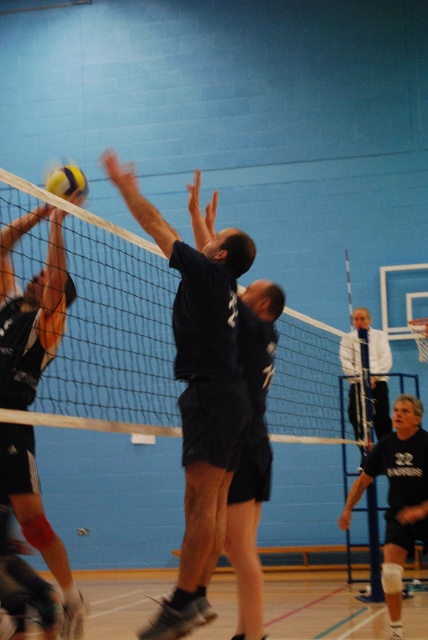
Question: Which of the following is the closest to the observer?

Choices:
 (A) (237, 388)
 (B) (330, 417)
 (C) (17, 324)
 (D) (374, 339)

Answer: (A)

Question: Can you confirm if white fabric shirt at upper center is thinner than yellowmaterial/texturevolleyball at upper left?

Choices:
 (A) no
 (B) yes

Answer: (A)

Question: Can you confirm if black matte shorts at center is positioned to the left of white fabric shirt at upper center?

Choices:
 (A) no
 (B) yes

Answer: (B)

Question: Among these points, which one is farthest from the camera?

Choices:
 (A) (210, 344)
 (B) (61, 230)
 (C) (425, 477)

Answer: (C)

Question: Which of the following is the farthest from the observer?

Choices:
 (A) yellowmaterial/texturevolleyball at upper left
 (B) black matte shorts at center
 (C) matte black shorts at center

Answer: (B)

Question: Does black matte shorts at center have a lesser width compared to yellowmaterial/texturevolleyball at upper left?

Choices:
 (A) no
 (B) yes

Answer: (A)